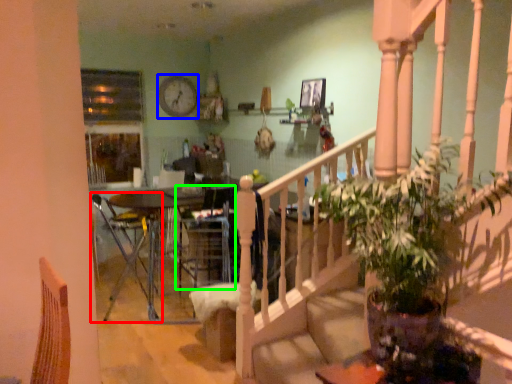
Question: Which is nearer to the chair (highlighted by a red box)? clock (highlighted by a blue box) or armchair (highlighted by a green box).

Choices:
 (A) clock
 (B) armchair

Answer: (B)